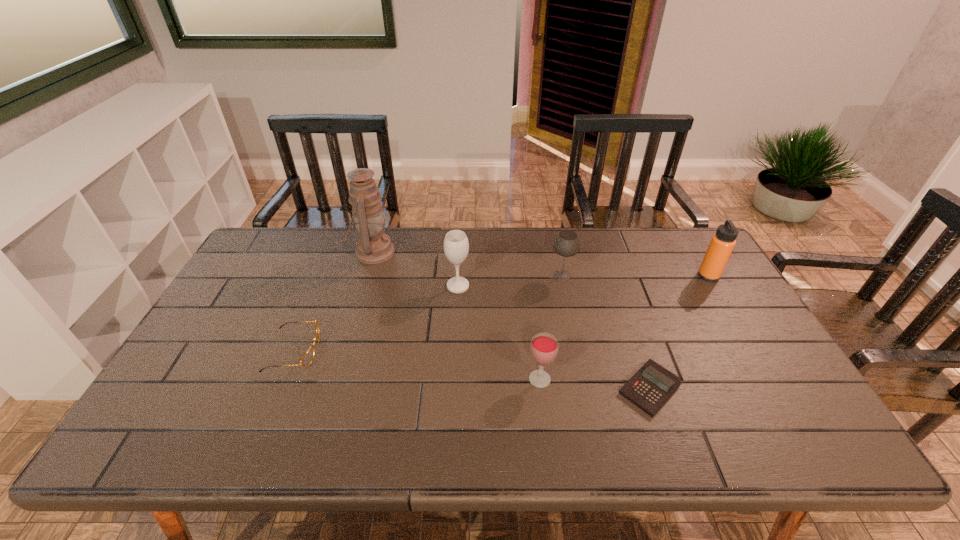
This screenshot has height=540, width=960. What are the coordinates of `oil lamp` in the screenshot? It's located at (373, 246).

Locate an element on the screen. thermos bottle is located at coordinates (722, 243).

Where is `the fifth object from right to left`? This screenshot has height=540, width=960. the fifth object from right to left is located at coordinates (456, 246).

Where is `the leftmost wineglass`? the leftmost wineglass is located at coordinates (456, 246).

Locate an element on the screen. The height and width of the screenshot is (540, 960). the rightmost wineglass is located at coordinates (566, 244).

Identify the location of the second wineglass from right to left. (544, 347).

Locate an element on the screen. Image resolution: width=960 pixels, height=540 pixels. the fourth object from right to left is located at coordinates (544, 347).

At what (x,y) coordinates should I click in order to perform the action: click on the sixth tallest object. Please return your answer as a coordinate pair (x, y). Looking at the image, I should click on (307, 358).

Identify the location of calculator. (652, 385).

You are a GUI agent. You are given a task and a screenshot of the screen. Output one action in this format:
    pyautogui.click(x=<x>, y=<y>)
    Task: Click on the shortest object
    Image resolution: width=960 pixels, height=540 pixels.
    Given the screenshot: What is the action you would take?
    (x=652, y=385)